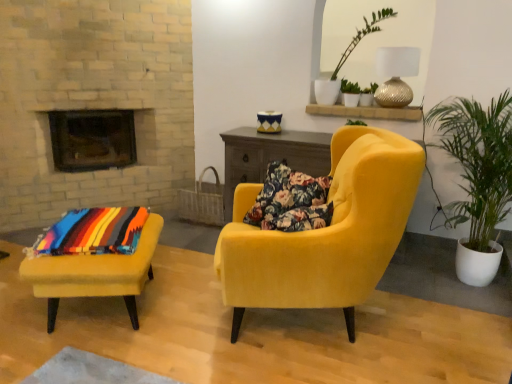
Where is `blank space to the left of velvet yellow armchair at center, which ranks as the first chair in right-to-left order`? The width and height of the screenshot is (512, 384). blank space to the left of velvet yellow armchair at center, which ranks as the first chair in right-to-left order is located at coordinates click(163, 317).